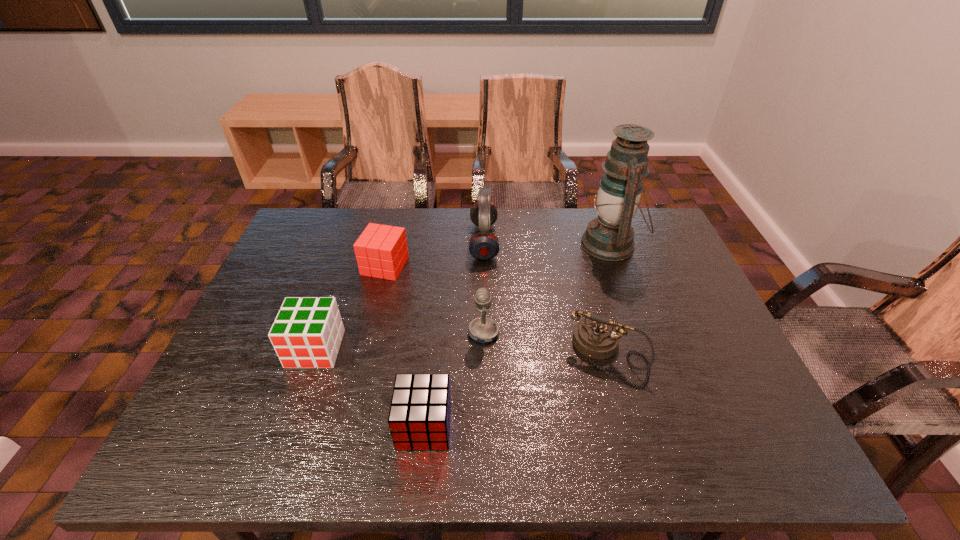
Image resolution: width=960 pixels, height=540 pixels. In order to click on oil lamp in this screenshot , I will do `click(609, 237)`.

Locate an element on the screen. The height and width of the screenshot is (540, 960). earphone is located at coordinates (483, 245).

The height and width of the screenshot is (540, 960). What are the coordinates of `the third tallest object` in the screenshot? It's located at (482, 329).

Where is `the second farthest cube`? the second farthest cube is located at coordinates pos(307,332).

Locate an element on the screen. This screenshot has width=960, height=540. telephone is located at coordinates (597, 337).

Locate an element on the screen. The width and height of the screenshot is (960, 540). the farthest cube is located at coordinates (381, 251).

The width and height of the screenshot is (960, 540). I want to click on the nearest object, so click(x=419, y=418).

Locate an element on the screen. The height and width of the screenshot is (540, 960). the rightmost cube is located at coordinates (419, 418).

At what (x,y) coordinates should I click in order to perform the action: click on free space located on the left of the tallest object. Please return your answer as a coordinate pair (x, y). Looking at the image, I should click on (504, 245).

The height and width of the screenshot is (540, 960). Identify the location of free region located on the ear cups of the sixth shortest object. (402, 241).